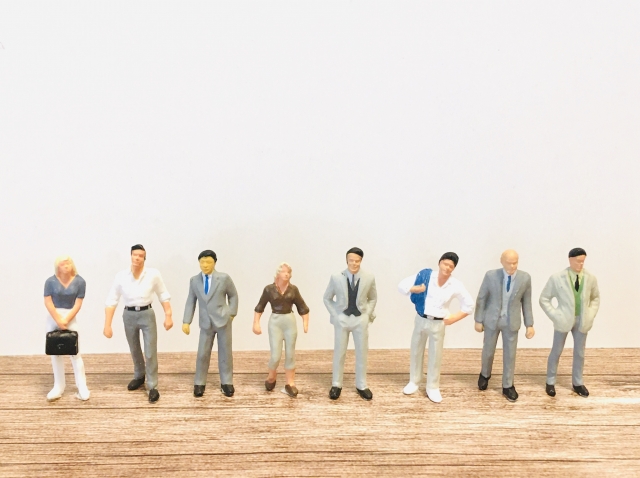
Identify the location of figurines not holding something. (141, 290), (208, 303), (287, 312), (356, 293), (505, 311), (573, 309).